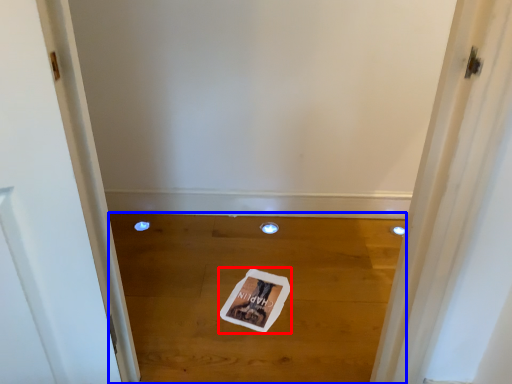
Question: Among these objects, which one is farthest to the camera, magazine (highlighted by a red box) or plain (highlighted by a blue box)?

Choices:
 (A) magazine
 (B) plain

Answer: (A)